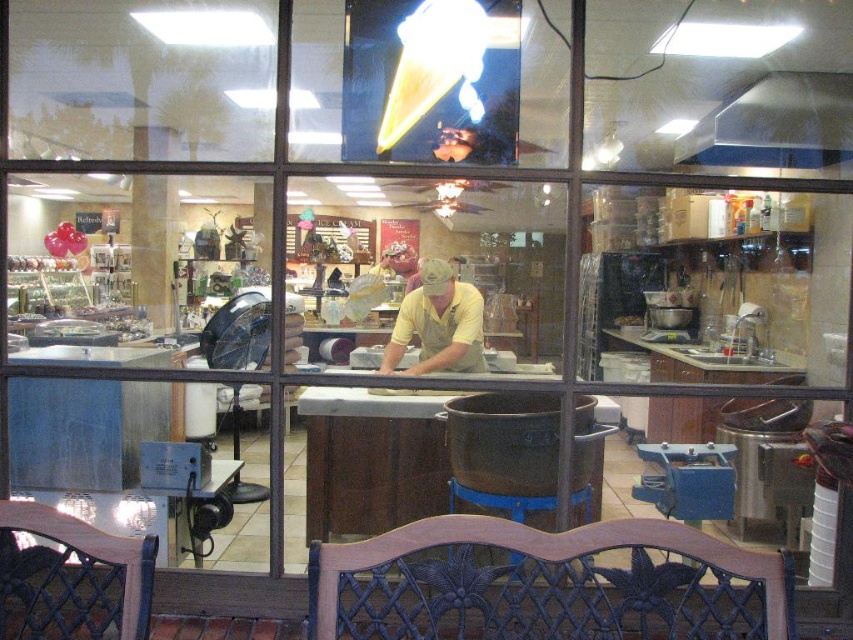
Can you confirm if wooden chair with dark finish at lower center is taller than wooden stool at center?

Yes.

Is wooden chair with dark finish at lower center to the left of wooden stool at center from the viewer's perspective?

Incorrect, wooden chair with dark finish at lower center is not on the left side of wooden stool at center.

Identify the location of wooden chair with dark finish at lower center. The height and width of the screenshot is (640, 853). (544, 584).

Can you confirm if wooden chair with dark finish at lower center is bigger than yellow matte shirt at center?

Correct, wooden chair with dark finish at lower center is larger in size than yellow matte shirt at center.

Between point (469, 528) and point (431, 337), which one is positioned behind?

The point (431, 337) is behind.

Identify the location of wooden chair with dark finish at lower center. This screenshot has width=853, height=640. (544, 584).

Who is more distant from viewer, (469, 364) or (496, 502)?

The point (469, 364) is behind.

Is point (466, 291) positioned before point (527, 500)?

No, (466, 291) is behind (527, 500).

Image resolution: width=853 pixels, height=640 pixels. I want to click on yellow matte shirt at center, so click(438, 324).